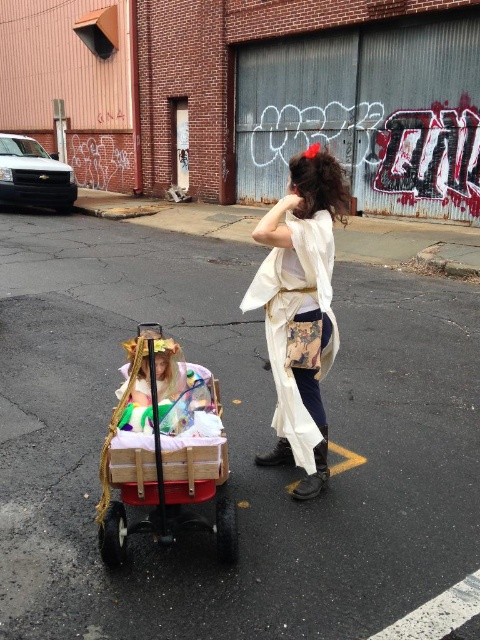
You are a delivery person who needs to place a package between the wooden baby carriage at center and the white silk kimono at center. The package requires 24 inches of space. Is there enough space between them?

The wooden baby carriage at center is 25.09 inches away from white silk kimono at center, so yes, there is enough space to place the package between them since 25.09 inches is greater than the required 24 inches.

You are a delivery person who needs to place both the wooden baby carriage at center and the white silk kimono at center into a storage box. The box can only hold one item. Which item should you choose to fit inside the box based on their sizes?

The wooden baby carriage at center has a smaller size compared to white silk kimono at center, so the wooden baby carriage at center would fit into the storage box.